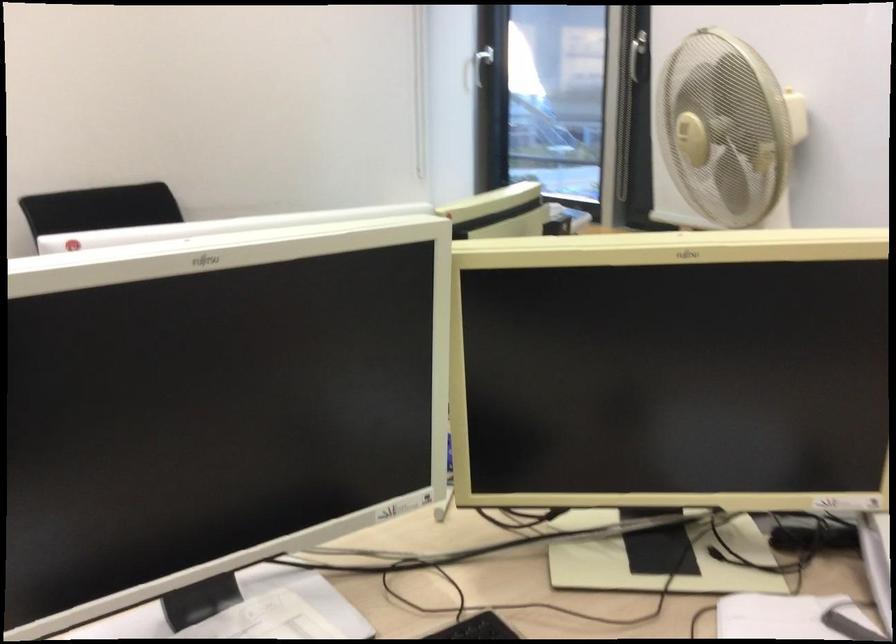
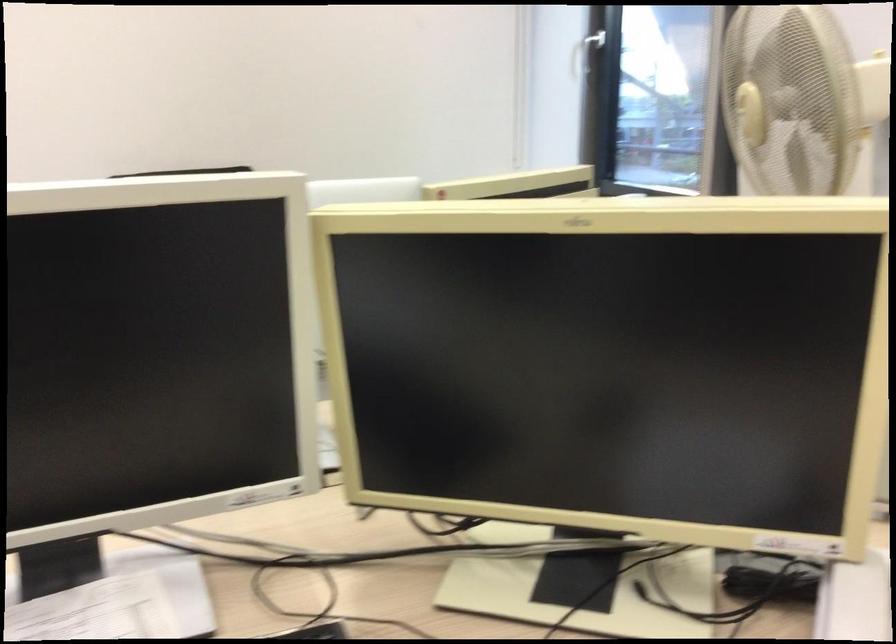
Question: How did the camera likely rotate?

Choices:
 (A) Left
 (B) Right
 (C) Up
 (D) Down

Answer: (A)